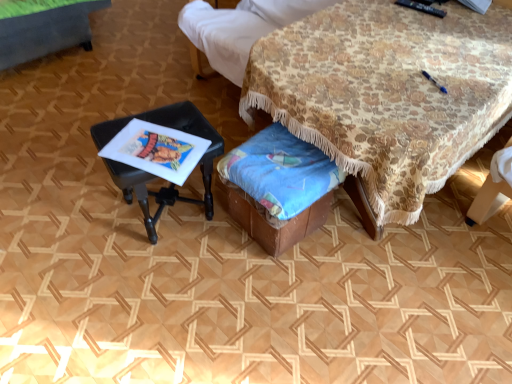
The width and height of the screenshot is (512, 384). In order to click on spots to the right of blue fabric at lower center in this screenshot , I will do `click(357, 249)`.